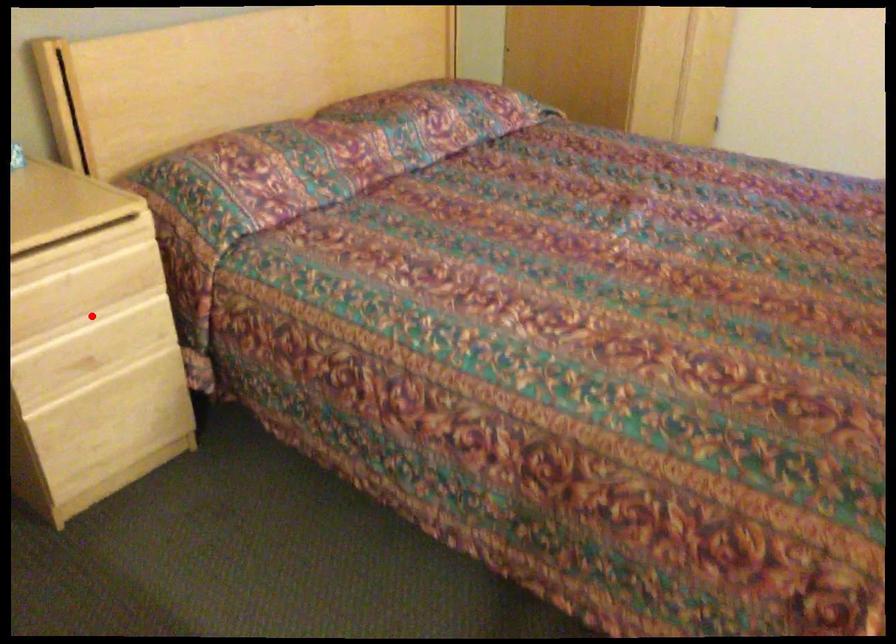
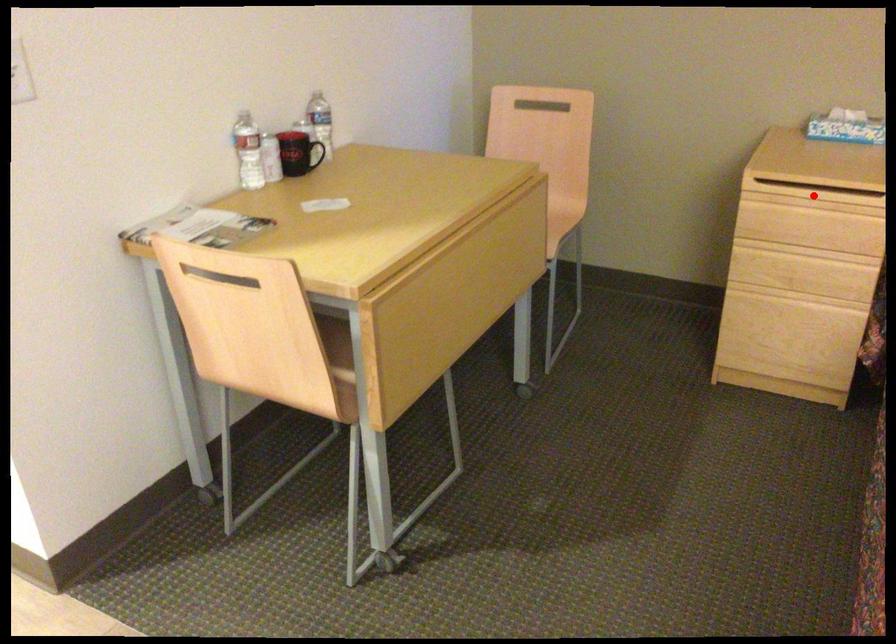
I am providing you with two images of the same scene from different viewpoints. A red point is marked on the first image and another point is marked on the second image. Does the point marked in image1 correspond to the same location as the one in image2?

No